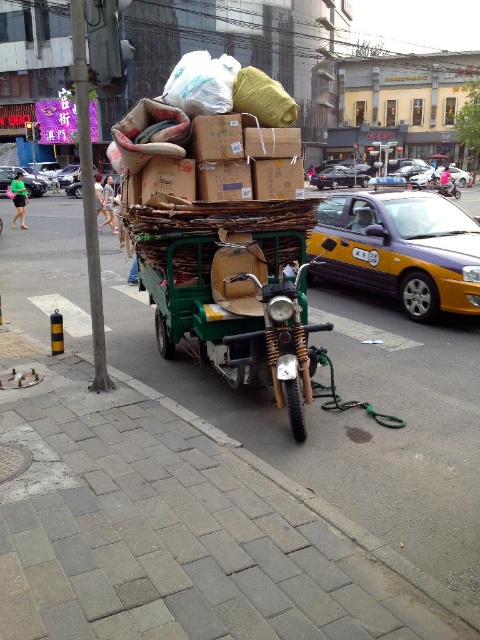
Does point (468, 285) come closer to viewer compared to point (441, 176)?

That is True.

In the scene shown: Can you confirm if yellow metallic taxi at center right is wider than metallic silver motorcycle at center?

Indeed, yellow metallic taxi at center right has a greater width compared to metallic silver motorcycle at center.

Is point (422, 234) more distant than point (454, 180)?

No.

In order to click on yellow metallic taxi at center right in this screenshot , I will do `click(400, 250)`.

Does shiny black sedan at left appear over metallic silver motorcycle at center?

Correct, shiny black sedan at left is located above metallic silver motorcycle at center.

Is shiny black sedan at left further to camera compared to metallic silver motorcycle at center?

That is True.

What do you see at coordinates (35, 186) in the screenshot? I see `shiny black sedan at left` at bounding box center [35, 186].

Find the location of a particular element. This screenshot has height=640, width=480. shiny black sedan at left is located at coordinates (35, 186).

Can you confirm if green matte tricycle at center is smaller than metallic silver motorcycle at center?

Actually, green matte tricycle at center might be larger than metallic silver motorcycle at center.

Does green matte tricycle at center have a greater height compared to metallic silver motorcycle at center?

Correct, green matte tricycle at center is much taller as metallic silver motorcycle at center.

The width and height of the screenshot is (480, 640). I want to click on green matte tricycle at center, so click(235, 308).